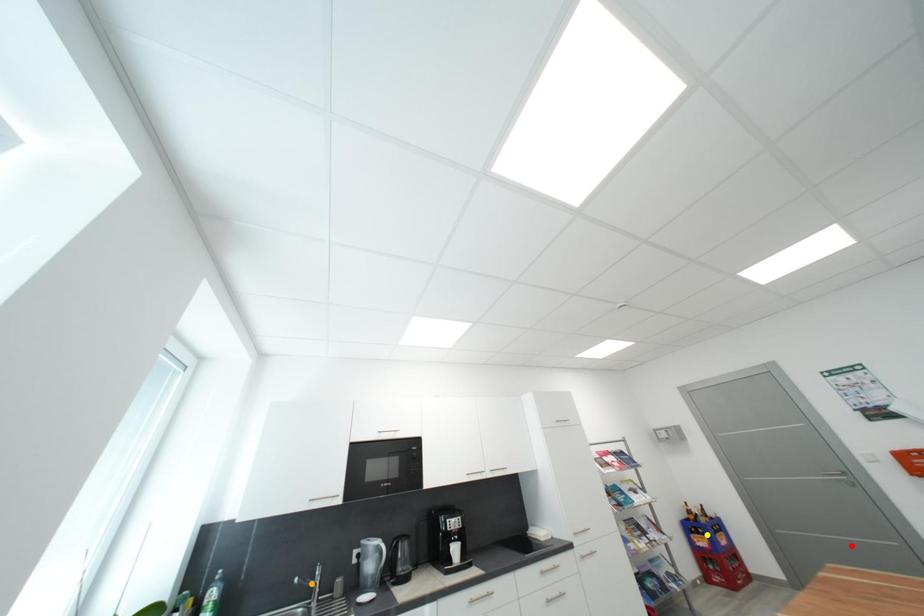
Order these from nearest to farthest:
A) red point
B) orange point
C) yellow point

red point
orange point
yellow point